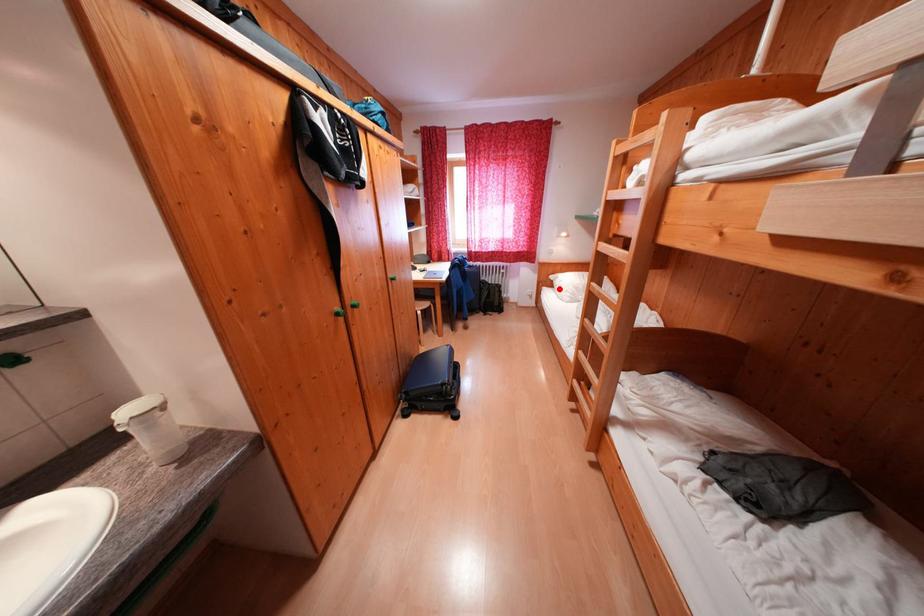
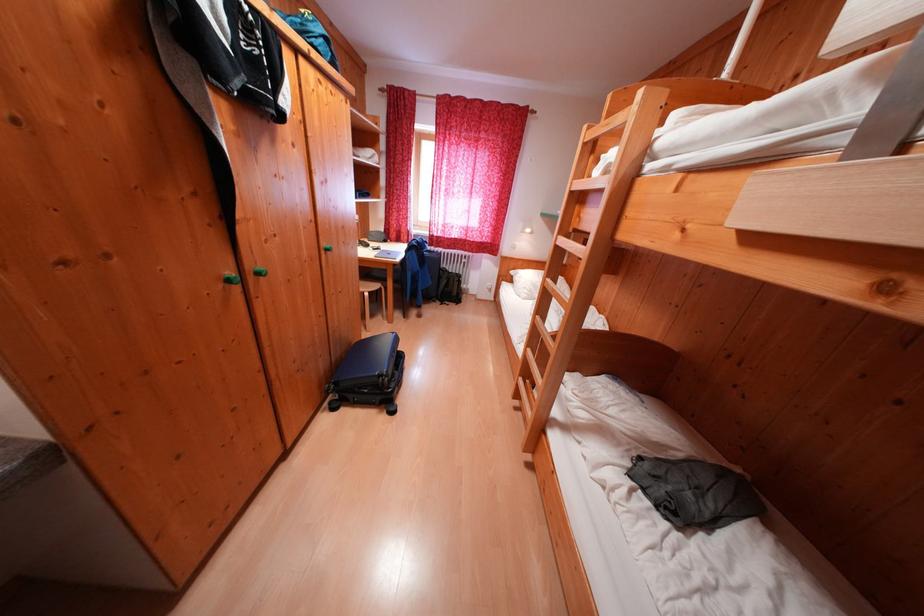
Question: I am providing you with two images of the same scene from different viewpoints. Given a red point in image1, look at the same physical point in image2. Is it:

Choices:
 (A) Closer to the viewpoint
 (B) Farther from the viewpoint

Answer: (B)